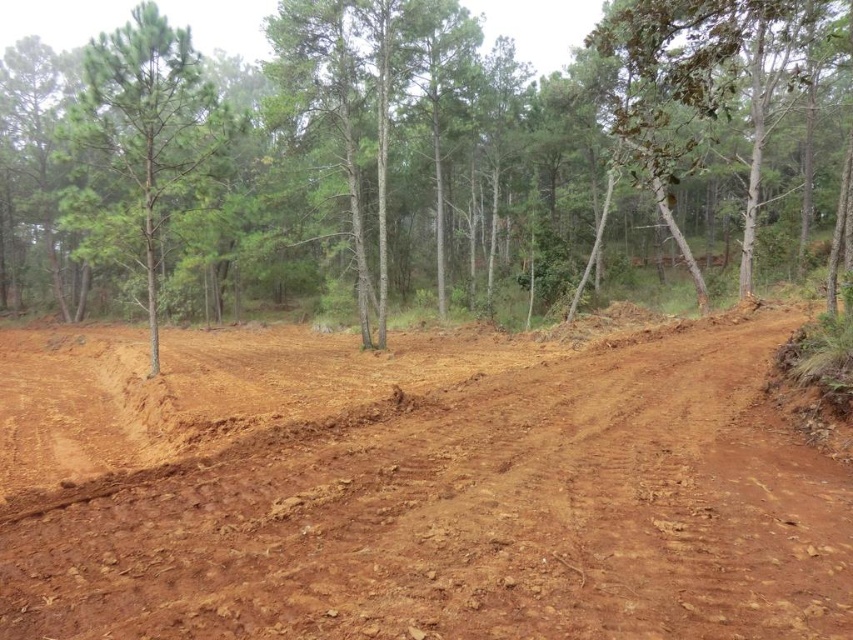
You are standing in the forest clearing and want to move towards the two points marked in the image. Which point, point (x=100, y=604) or point (x=727, y=19), is closer to you?

Point (x=100, y=604) is closer to the viewer than point (x=727, y=19), so you should head towards point (x=100, y=604) first.

You are a hiker who wants to take a photo of both the green textured tree at upper left and the green leafy tree at upper right. Which tree should you position yourself to the left of to capture both in the frame?

You should position yourself to the left of the green textured tree at upper left to capture both trees in the frame since it is already positioned to the left of the green leafy tree at upper right.

You are a hiker trying to navigate through the forest. You see the green textured tree at upper left and the green matte tree at left. Which one would you need to look up higher to see the top of?

The green textured tree at upper left is taller than the green matte tree at left, so you would need to look up higher to see the top of the green textured tree at upper left.